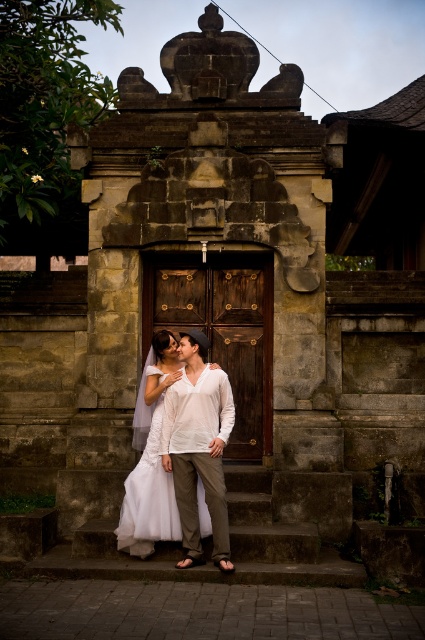
From the picture: You are a photographer trying to capture a photo of the white cotton shirt at center and the stone stairs at center. Based on their positions, which object is closer to the camera?

The white cotton shirt at center is closer to the camera because it is above the stone stairs at center, which is positioned below it.

You are a photographer planning to take a picture of the couple standing in front of the traditional stone structure. Given that the white cotton shirt at center is larger than the white lace dress at center, which clothing item would you suggest the couple adjust to ensure both are equally visible in the photo?

The white cotton shirt at center is bigger than the white lace dress at center, so adjusting the white lace dress at center to be more prominent or moving the wearer closer to the camera could help balance their visibility.

You are a photographer planning to take a portrait of the couple standing on the stone stairs at center and the white cotton shirt at center. Considering the size difference between the two, which object should you focus on to ensure the subject is properly framed?

The white cotton shirt at center is larger than the stone stairs at center, so focusing on the white cotton shirt at center would ensure proper framing of the subject.